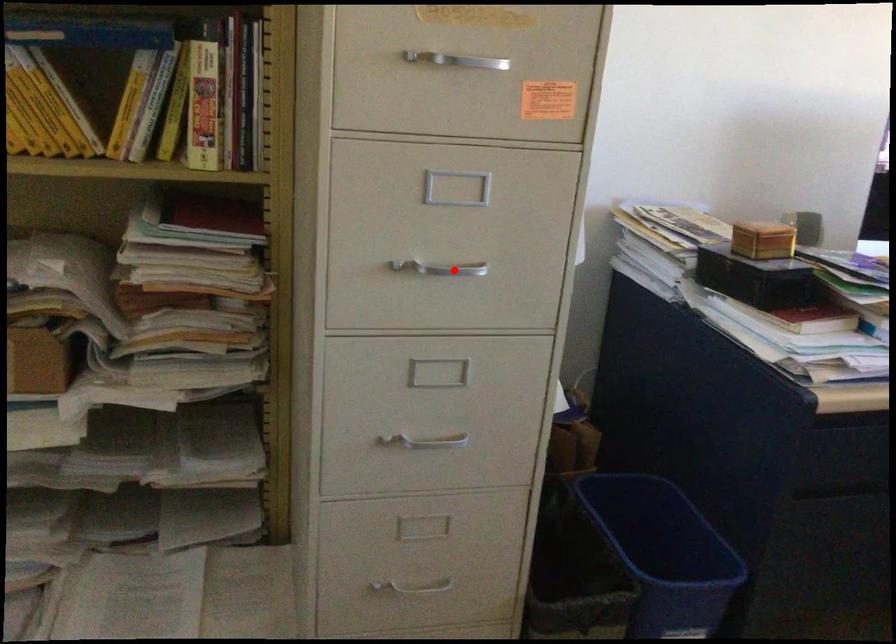
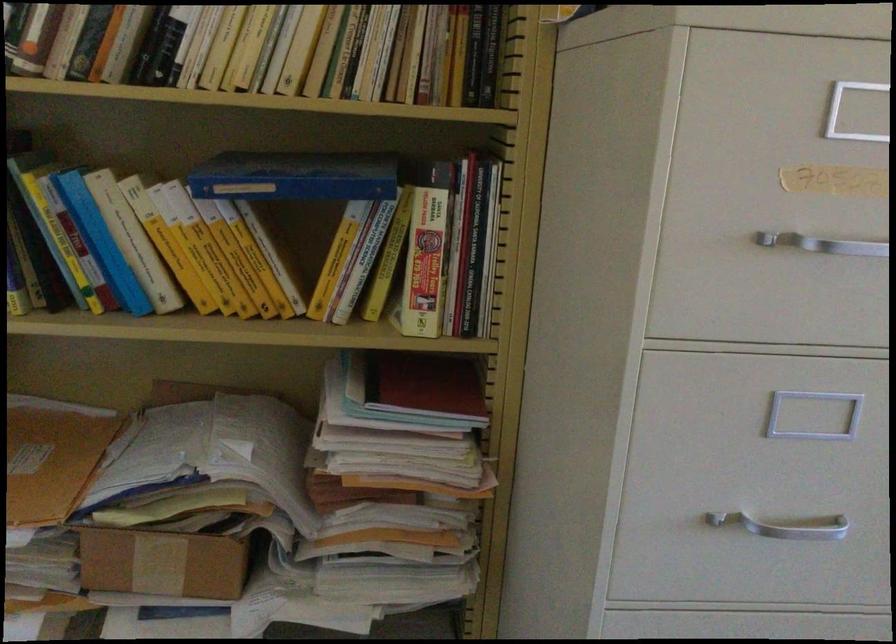
Locate, in the second image, the point that corresponds to the highlighted location in the first image.

(784, 526)